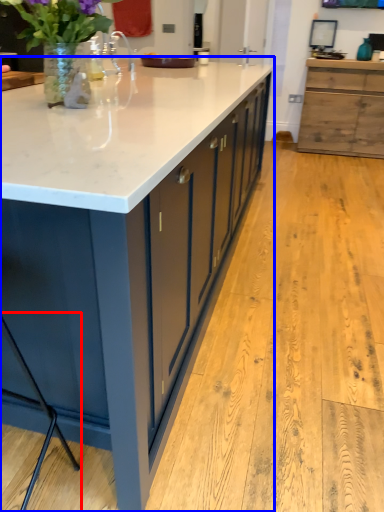
Question: Which object appears closest to the camera in this image, bar stool (highlighted by a red box) or countertop (highlighted by a blue box)?

Choices:
 (A) bar stool
 (B) countertop

Answer: (A)